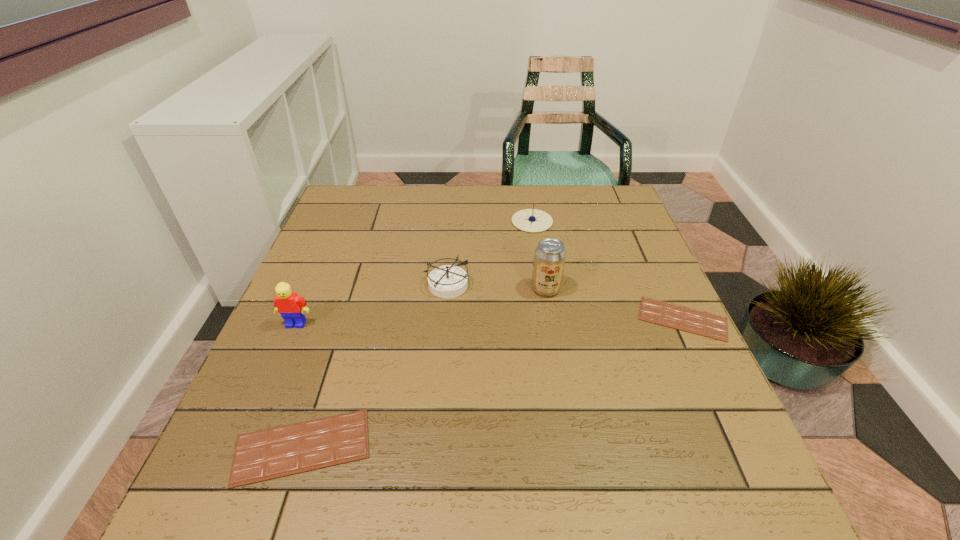
To make them evenly spaced by inserting another chocolate_bar among them, please locate a free space for this new chocolate_bar. Please provide its 2D coordinates. Your answer should be formatted as a tuple, i.e. [(x, y)], where the tuple contains the x and y coordinates of a point satisfying the conditions above.

[(517, 374)]